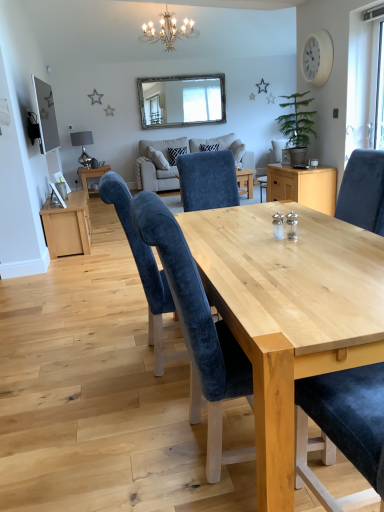
What are the coordinates of `free space to the left of velvet blue chair at center, arranged as the first chair when viewed from the back` in the screenshot? It's located at (94, 366).